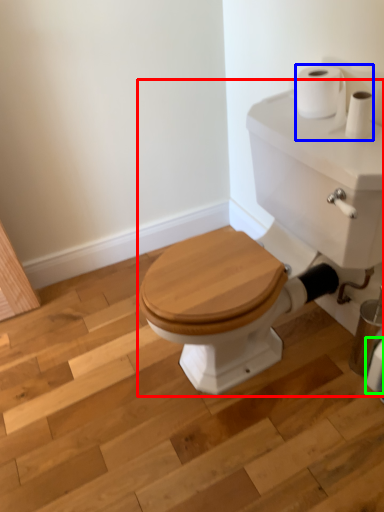
Question: Considering the real-world distances, which object is farthest from porcelain (highlighted by a red box)? toilet paper (highlighted by a blue box) or toilet paper (highlighted by a green box)?

Choices:
 (A) toilet paper
 (B) toilet paper

Answer: (B)